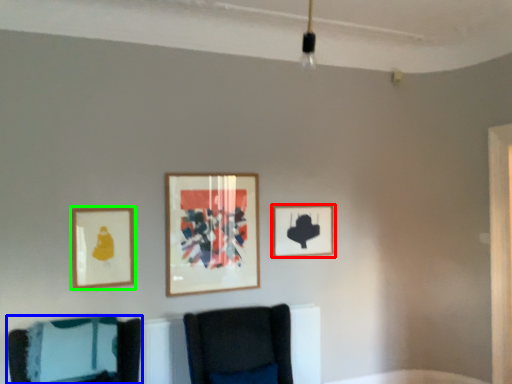
Question: Estimate the real-world distances between objects in this image. Which object is closer to picture frame (highlighted by a red box), furniture (highlighted by a blue box) or picture frame (highlighted by a green box)?

Choices:
 (A) furniture
 (B) picture frame

Answer: (B)